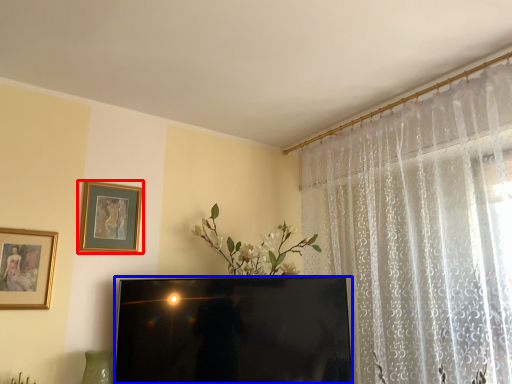
Question: Which object appears closest to the camera in this image, picture frame (highlighted by a red box) or television (highlighted by a blue box)?

Choices:
 (A) picture frame
 (B) television

Answer: (B)